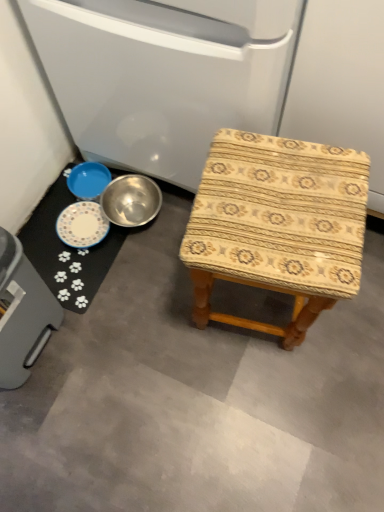
At what (x,y) coordinates should I click in order to perform the action: click on free region on the left part of blue metallic bowl at lower left. Please return your answer as a coordinate pair (x, y). Looking at the image, I should click on (54, 202).